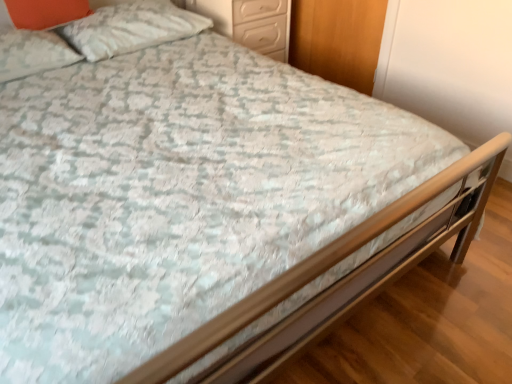
Question: Considering the positions of white textured pillow at upper left, the 3th pillow viewed from the left, and white glossy drawers at upper center in the image, is white textured pillow at upper left, the 3th pillow viewed from the left, bigger or smaller than white glossy drawers at upper center?

Choices:
 (A) small
 (B) big

Answer: (A)

Question: Would you say white textured pillow at upper left, the 3th pillow viewed from the left, is to the left or to the right of white glossy drawers at upper center in the picture?

Choices:
 (A) left
 (B) right

Answer: (A)

Question: Which object is positioned farthest from the white soft pillow at upper left, which is the first pillow in left-to-right order?

Choices:
 (A) white glossy drawers at upper center
 (B) white textured pillow at upper left, the first pillow in the right-to-left sequence
 (C) orange matte pillow at upper left, which is the 2th pillow in left-to-right order

Answer: (A)

Question: Which object is positioned farthest from the white soft pillow at upper left, the third pillow from the right?

Choices:
 (A) orange matte pillow at upper left, which is the 2th pillow in left-to-right order
 (B) white glossy drawers at upper center
 (C) white textured pillow at upper left, the first pillow in the right-to-left sequence

Answer: (B)